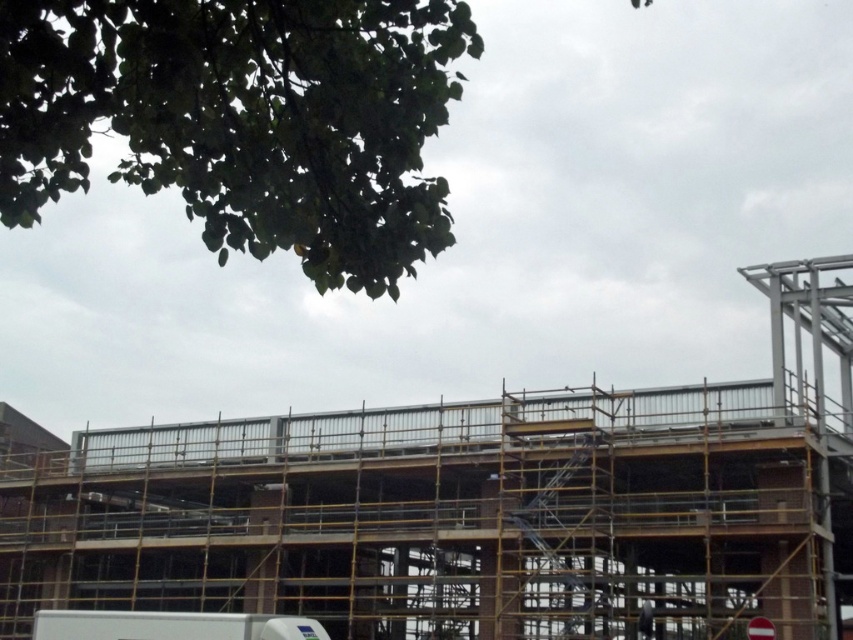
Which of these two, metal scaffolding at center or dark gray fabric construction worker at lower right, stands taller?

metal scaffolding at center is taller.

Is metal scaffolding at center thinner than dark gray fabric construction worker at lower right?

No.

Describe the element at coordinates (473, 506) in the screenshot. I see `metal scaffolding at center` at that location.

This screenshot has width=853, height=640. What are the coordinates of `metal scaffolding at center` in the screenshot? It's located at (473, 506).